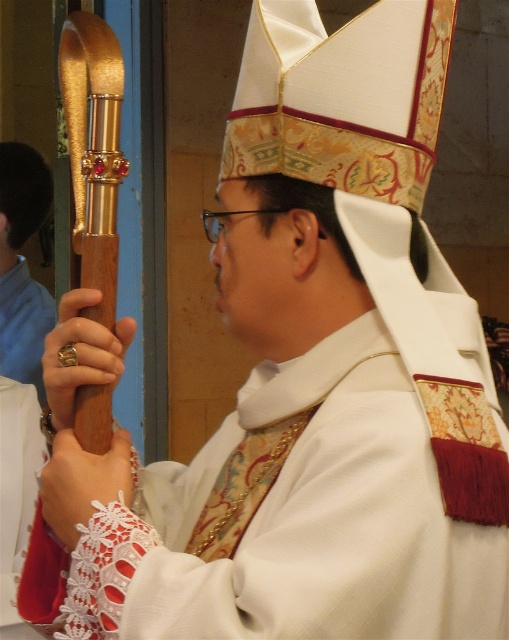
Does gold metallic ring at lower left have a lesser width compared to white lace at lower left?

Incorrect, gold metallic ring at lower left's width is not less than white lace at lower left's.

Can you confirm if gold metallic ring at lower left is shorter than white lace at lower left?

No.

Does point (69, 316) come behind point (44, 483)?

Yes, it is.

You are a GUI agent. You are given a task and a screenshot of the screen. Output one action in this format:
    pyautogui.click(x=<x>, y=<y>)
    Task: Click on the gold metallic ring at lower left
    Image resolution: width=509 pixels, height=640 pixels.
    Given the screenshot: What is the action you would take?
    pyautogui.click(x=80, y=353)

Can you confirm if gold polished staff at upper left is positioned below gold metallic ring at lower left?

No.

Is gold polished staff at upper left to the left of gold metallic ring at lower left from the viewer's perspective?

Yes, gold polished staff at upper left is to the left of gold metallic ring at lower left.

Does point (20, 259) lie behind point (68, 365)?

Yes.

Locate an element on the screen. gold polished staff at upper left is located at coordinates (21, 264).

Between gold polished staff at upper left and white lace at lower left, which one is positioned higher?

Positioned higher is gold polished staff at upper left.

Is gold polished staff at upper left below white lace at lower left?

Incorrect, gold polished staff at upper left is not positioned below white lace at lower left.

Locate an element on the screen. Image resolution: width=509 pixels, height=640 pixels. gold polished staff at upper left is located at coordinates (21, 264).